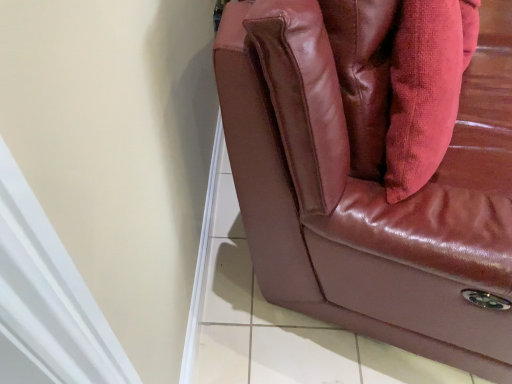
Find the location of a particular element. This screenshot has height=384, width=512. glossy leather couch at upper right is located at coordinates (367, 183).

The image size is (512, 384). What do you see at coordinates (367, 183) in the screenshot? I see `glossy leather couch at upper right` at bounding box center [367, 183].

Where is `glossy leather couch at upper right`? This screenshot has height=384, width=512. glossy leather couch at upper right is located at coordinates (367, 183).